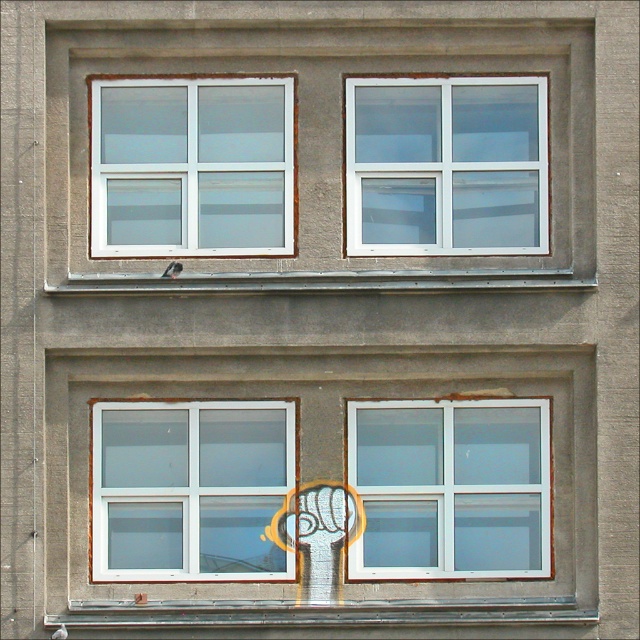
You are an architect analyzing the building facade. You notice the white plastic window at upper right and the white plastic window at upper left. Based on their positions, which window is located higher on the facade?

The white plastic window at upper right is located higher on the facade than the white plastic window at upper left because it is positioned above it.

Looking at this image, you are standing in front of the building facade and want to touch both points mentioned. Which point should you reach for first, the point at coordinates (x=419, y=237) or the point at (x=205, y=221)?

You should reach for point (x=419, y=237) first because it is closer to you than point (x=205, y=221).

You are standing in front of the building facade and want to know which window you can see more clearly between the white plastic window at upper right and the white plastic window at upper left. Based on their positions, which one is more visible?

The white plastic window at upper right is in front of the white plastic window at upper left, so it is more visible.